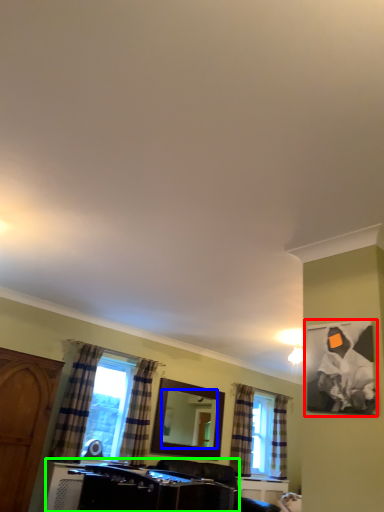
Question: Considering the real-world distances, which object is farthest from picture frame (highlighted by a red box)? mirror (highlighted by a blue box) or vanity (highlighted by a green box)?

Choices:
 (A) mirror
 (B) vanity

Answer: (A)